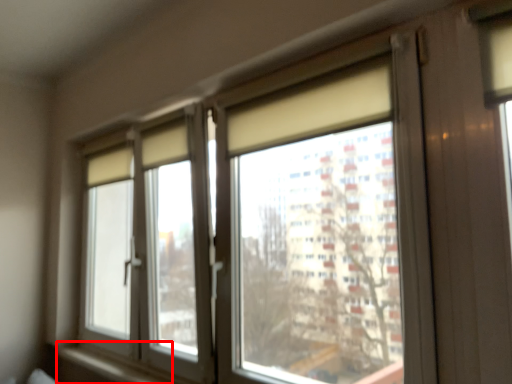
Question: From the image, what is the correct spatial relationship of window sill (annotated by the red box) in relation to window?

Choices:
 (A) right
 (B) left

Answer: (B)